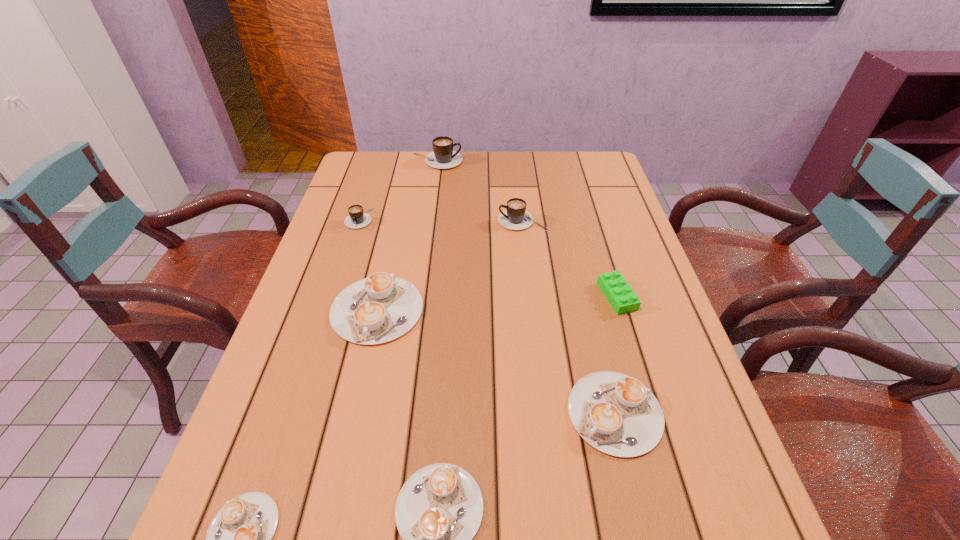
Find the location of a particular element. the farthest black cappuccino is located at coordinates (443, 156).

Locate an element on the screen. The image size is (960, 540). the biggest black cappuccino is located at coordinates (443, 156).

You are a GUI agent. You are given a task and a screenshot of the screen. Output one action in this format:
    pyautogui.click(x=<x>, y=<y>)
    Task: Click on the rightmost black cappuccino
    This screenshot has height=540, width=960.
    Given the screenshot: What is the action you would take?
    pyautogui.click(x=515, y=217)

Image resolution: width=960 pixels, height=540 pixels. Identify the location of the seventh shortest object. coord(515,217).

This screenshot has width=960, height=540. I want to click on the smallest black cappuccino, so click(357, 218).

Locate an element on the screen. The image size is (960, 540). the fourth farthest cappuccino is located at coordinates (382, 307).

This screenshot has width=960, height=540. Find the location of `the farthest white cappuccino`. the farthest white cappuccino is located at coordinates (382, 307).

I want to click on green Lego, so click(x=619, y=294).

At what (x,y) coordinates should I click in order to perform the action: click on the third shortest cappuccino. Please return your answer as a coordinate pair (x, y). This screenshot has height=540, width=960. Looking at the image, I should click on (616, 414).

I want to click on the fifth farthest cappuccino, so pos(616,414).